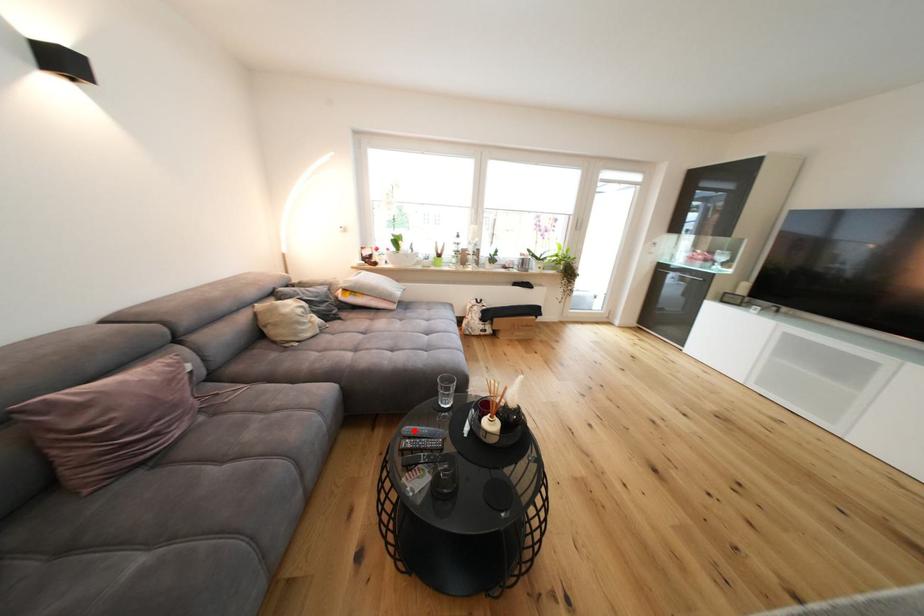
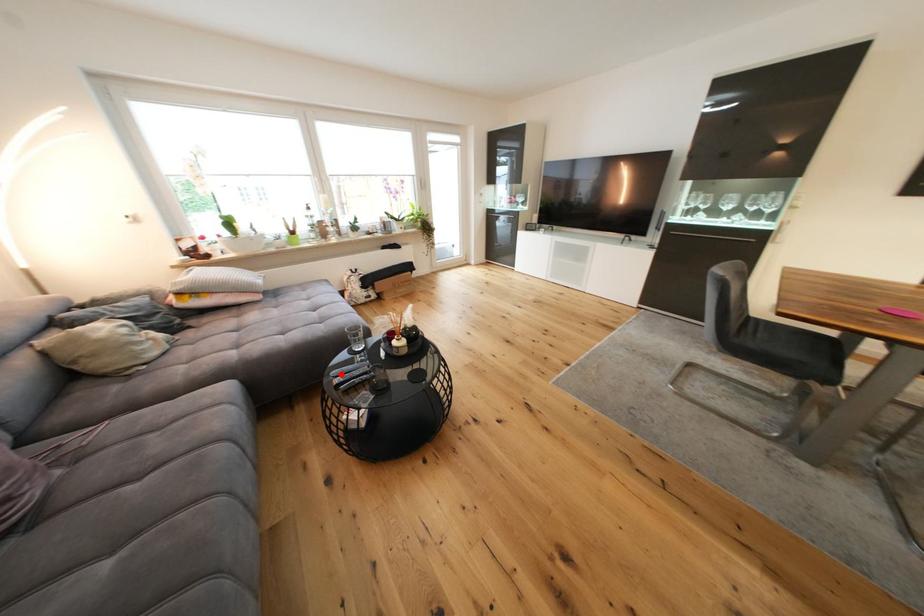
I am providing you with two images of the same scene from different viewpoints. A red point is marked on the first image and another point is marked on the second image. Is the red point in image1 aligned with the point shown in image2?

Yes